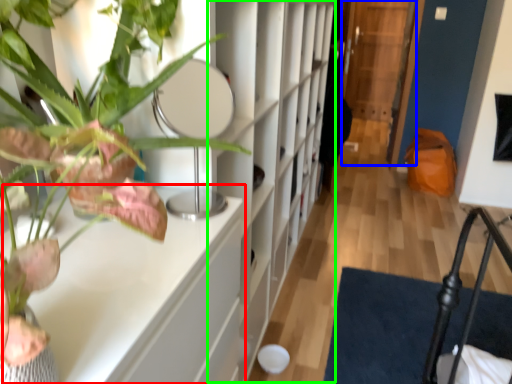
Question: Which object is positioned farthest from table (highlighted by a red box)? Select from glass door (highlighted by a blue box) and bookshelf (highlighted by a green box).

Choices:
 (A) glass door
 (B) bookshelf

Answer: (A)